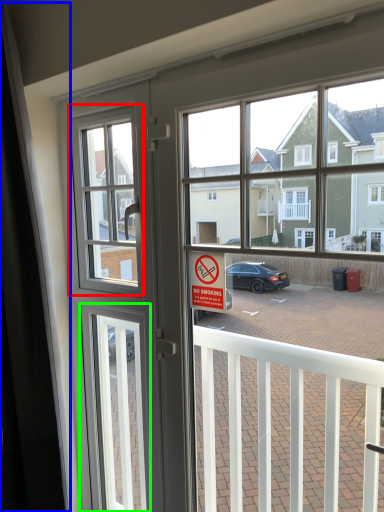
Question: Considering the real-world distances, which object is closest to window screen (highlighted by a red box)? curtain (highlighted by a blue box) or screen door (highlighted by a green box).

Choices:
 (A) curtain
 (B) screen door

Answer: (A)